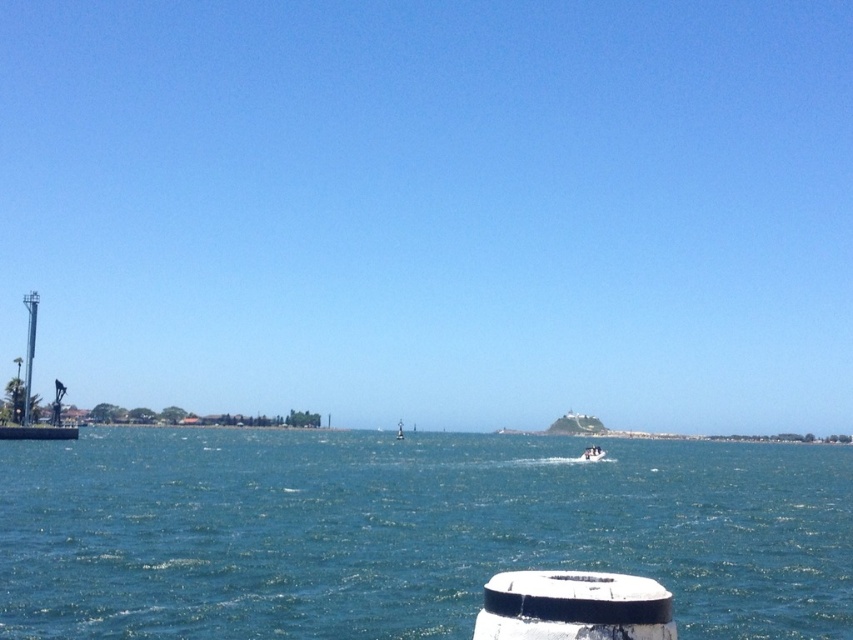
Question: Among these points, which one is farthest from the camera?

Choices:
 (A) (401, 438)
 (B) (599, 445)
 (C) (91, 598)

Answer: (A)

Question: Which is farther from the white matte boat at center?

Choices:
 (A) white glossy boat at center
 (B) blue water at center

Answer: (A)

Question: In this image, where is blue water at center located relative to white matte boat at center?

Choices:
 (A) left
 (B) right

Answer: (B)

Question: Is white matte boat at center bigger than white glossy boat at center?

Choices:
 (A) yes
 (B) no

Answer: (B)

Question: Can you confirm if blue water at center is smaller than white matte boat at center?

Choices:
 (A) yes
 (B) no

Answer: (B)

Question: Which point is closer to the camera taking this photo?

Choices:
 (A) (398, 440)
 (B) (268, 509)

Answer: (B)